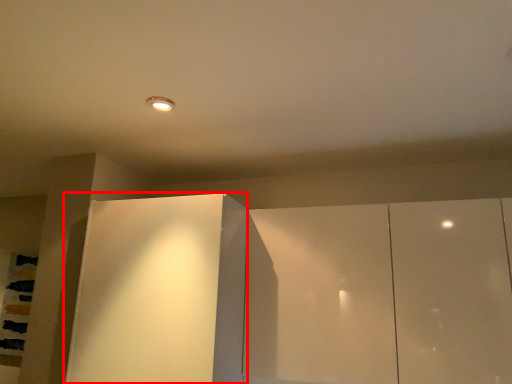
Question: In this image, where is glass door (annotated by the red box) located relative to cupboard?

Choices:
 (A) right
 (B) left

Answer: (B)